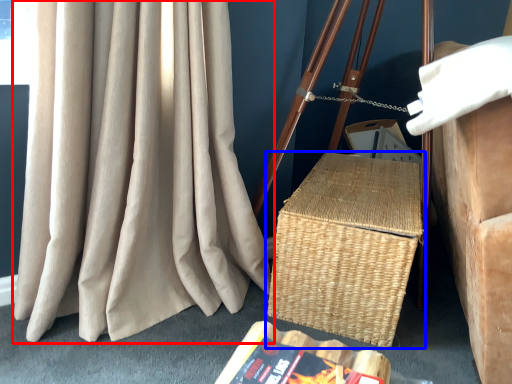
Question: Among these objects, which one is nearest to the camera, curtain (highlighted by a red box) or picnic basket (highlighted by a blue box)?

Choices:
 (A) curtain
 (B) picnic basket

Answer: (A)